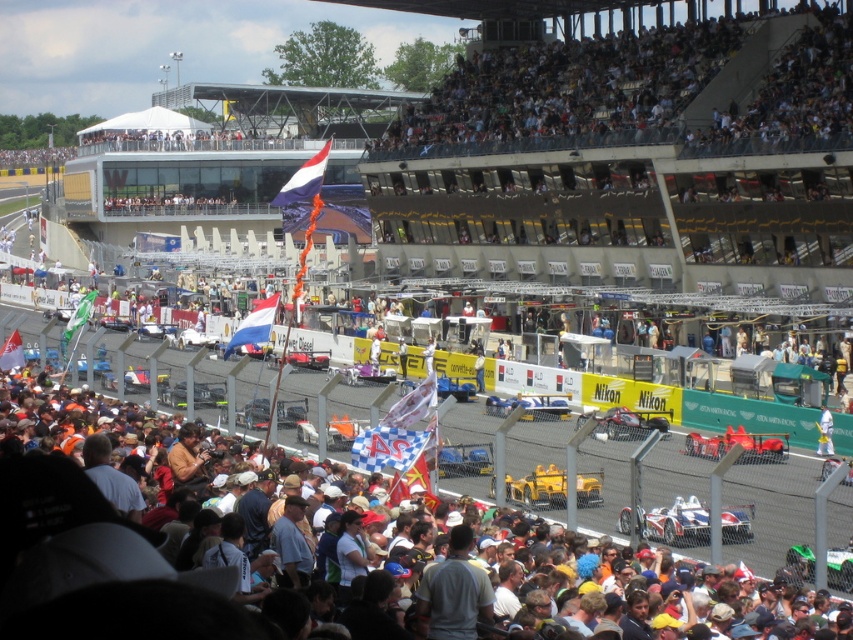
Question: Is white cotton shirt at lower center to the right of yellow matte race car at center from the viewer's perspective?

Choices:
 (A) no
 (B) yes

Answer: (A)

Question: Which point appears farthest from the camera in this image?

Choices:
 (A) pos(299,176)
 (B) pos(492,413)
 (C) pos(639,577)
 (D) pos(848,552)

Answer: (B)

Question: Which object appears closest to the camera in this image?

Choices:
 (A) shiny red race car at center
 (B) green matte race car at lower right

Answer: (B)

Question: Is white plastic seats at upper center further to camera compared to white matte race car at center?

Choices:
 (A) yes
 (B) no

Answer: (A)

Question: Can you confirm if white cotton shirt at lower center is positioned above white fabric person at lower right?

Choices:
 (A) yes
 (B) no

Answer: (B)

Question: Which object is farther from the camera taking this photo?

Choices:
 (A) shiny red race car at center
 (B) white matte race car at center
 (C) yellow metallic race car at center
 (D) white fabric flag at center

Answer: (D)